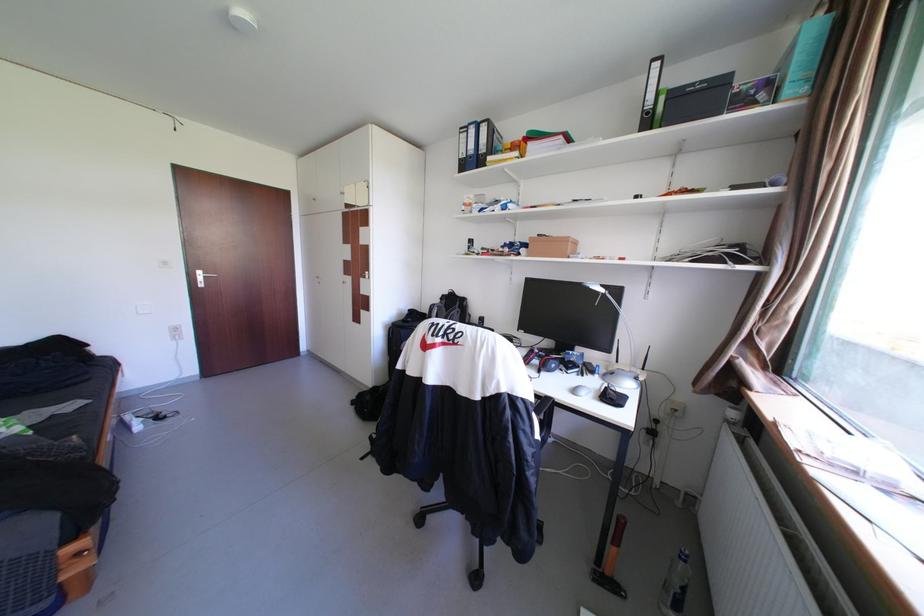
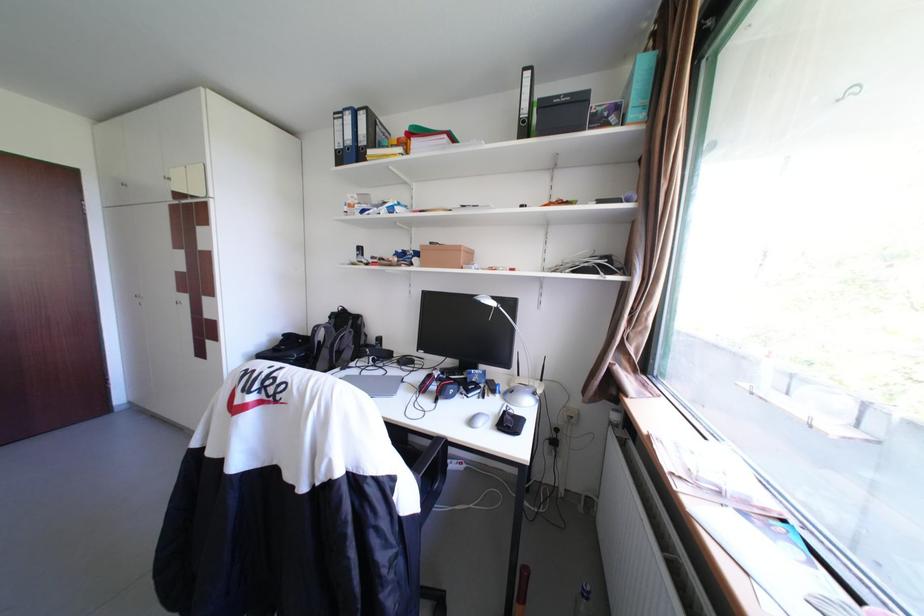
Locate, in the second image, the point that corresponds to (321,200) in the first image.

(130, 185)